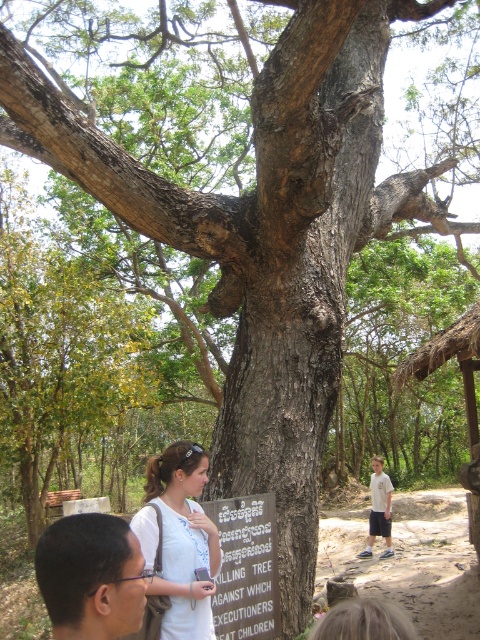
The width and height of the screenshot is (480, 640). Describe the element at coordinates (180, 540) in the screenshot. I see `light brown hair at lower center` at that location.

Which is in front, point (148, 534) or point (372, 458)?

Point (148, 534) is more forward.

Between point (170, 560) and point (382, 490), which one is positioned behind?

The point (382, 490) is more distant.

Find the location of a particular element. This screenshot has width=480, height=640. light brown hair at lower center is located at coordinates click(x=180, y=540).

Between black hair at lower left and light brown hair at lower center, which one appears on the left side from the viewer's perspective?

black hair at lower left

Is point (113, 579) less distant than point (194, 529)?

Yes, it is in front of point (194, 529).

Find the location of `black hair at lower left`. black hair at lower left is located at coordinates (91, 577).

Between light brown hair at lower center and wooden signboard at center, which one is positioned higher?

light brown hair at lower center is higher up.

Is light brown hair at lower center above wooden signboard at center?

Yes.

Find the location of a particular element. The image size is (480, 640). light brown hair at lower center is located at coordinates (180, 540).

Locate an element on the screen. The image size is (480, 640). light brown hair at lower center is located at coordinates click(180, 540).